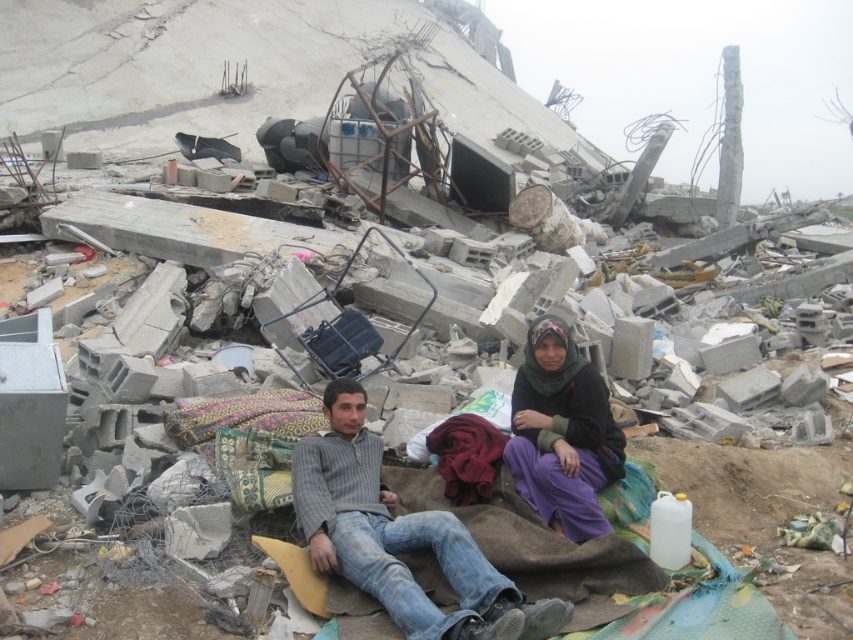
Question: Is gray striped sweater at center above purple cotton dress at center?

Choices:
 (A) yes
 (B) no

Answer: (B)

Question: Is gray striped sweater at center closer to camera compared to purple cotton dress at center?

Choices:
 (A) yes
 (B) no

Answer: (A)

Question: Among these objects, which one is farthest from the camera?

Choices:
 (A) gray striped sweater at center
 (B) purple cotton dress at center

Answer: (B)

Question: Is gray striped sweater at center further to the viewer compared to purple cotton dress at center?

Choices:
 (A) no
 (B) yes

Answer: (A)